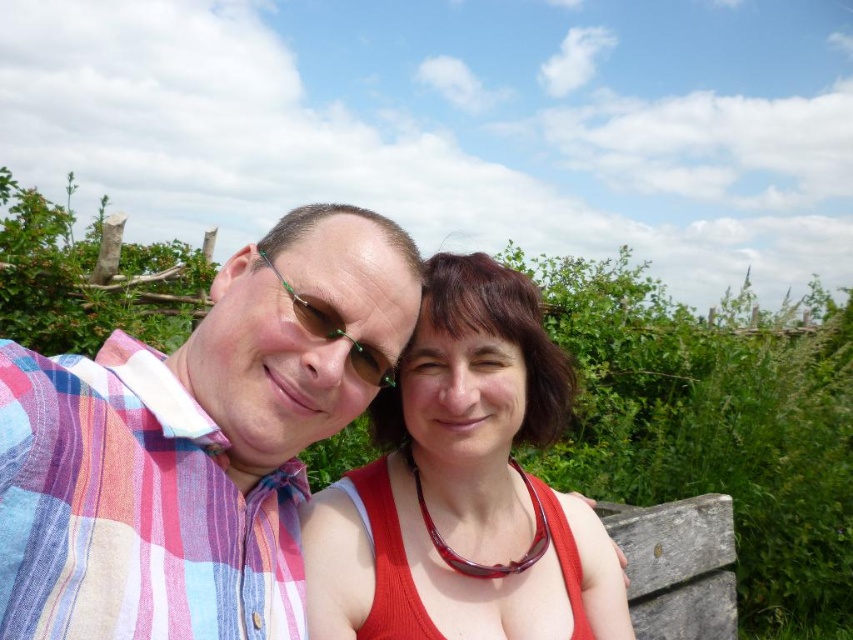
Question: Can you confirm if matte red tank top at center is positioned to the left of green reflective sunglasses at center?

Choices:
 (A) no
 (B) yes

Answer: (A)

Question: Can you confirm if plaid shirt at left is wider than matte red tank top at center?

Choices:
 (A) no
 (B) yes

Answer: (A)

Question: Does plaid shirt at left have a smaller size compared to green reflective sunglasses at center?

Choices:
 (A) yes
 (B) no

Answer: (B)

Question: Which of the following is the farthest from the observer?

Choices:
 (A) matte red tank top at center
 (B) plaid shirt at left

Answer: (A)

Question: Which is farther from the matte red tank top at center?

Choices:
 (A) plaid shirt at left
 (B) green reflective sunglasses at center

Answer: (B)

Question: Which object is positioned farthest from the plaid shirt at left?

Choices:
 (A) matte red tank top at center
 (B) green reflective sunglasses at center

Answer: (A)